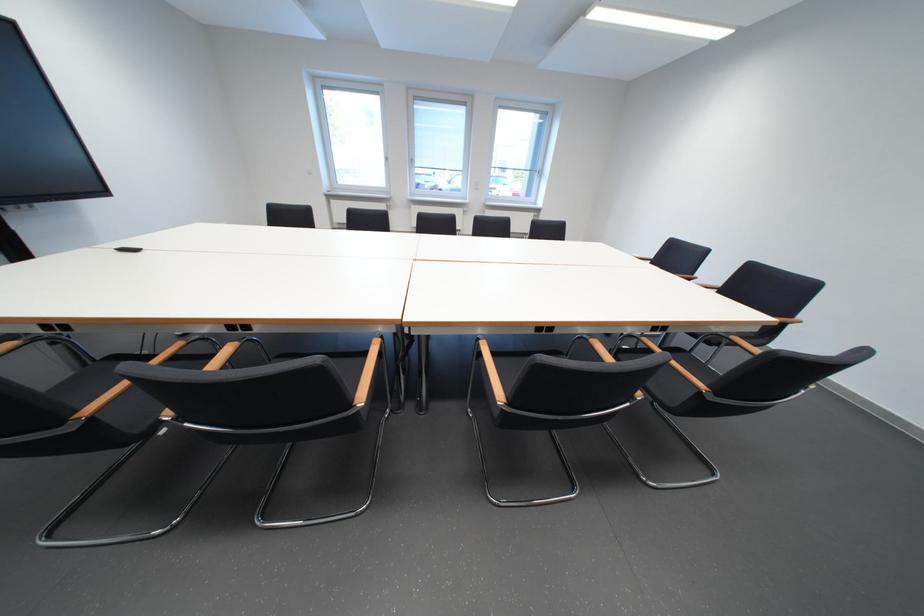
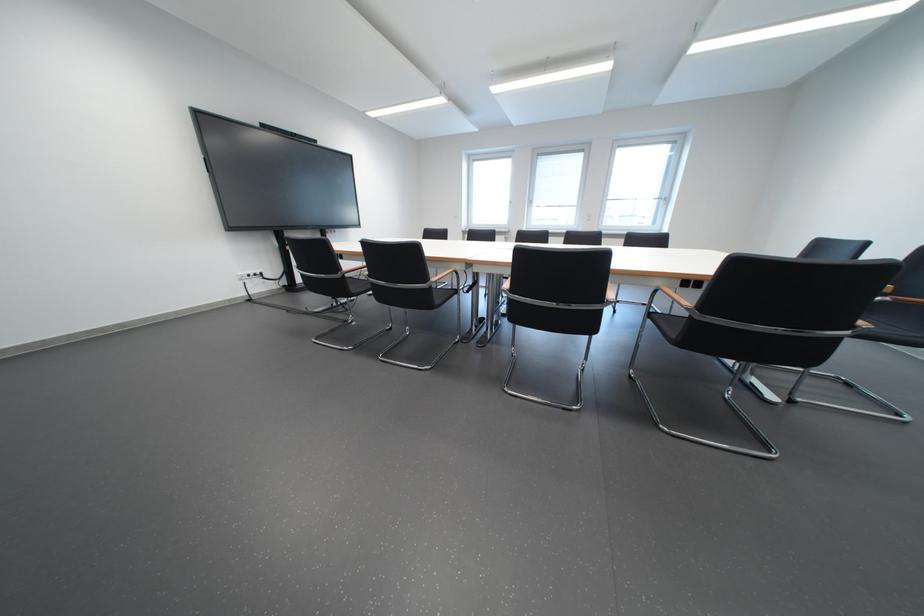
Question: The camera is either moving clockwise (left) or counter-clockwise (right) around the object. The first image is from the beginning of the video and the second image is from the end. Is the camera moving left or right when shooting the video?

Choices:
 (A) Left
 (B) Right

Answer: (B)